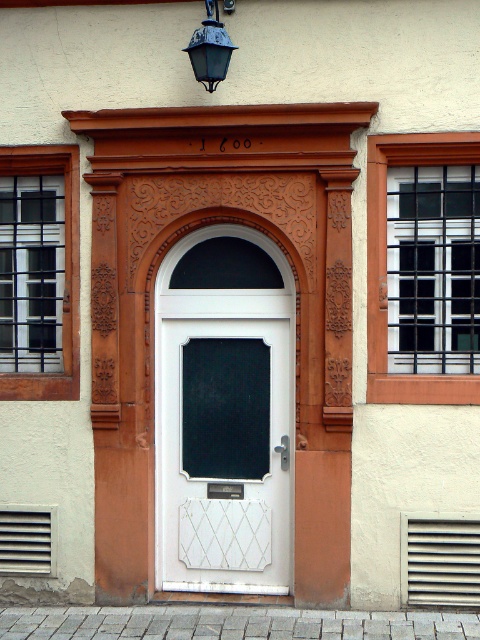
You are standing in front of the building and see the point marked at coordinates (x=223, y=452). Which object is this point located on?

The point marked at coordinates (x=223, y=452) is located on the white glossy door at center.

You are an architect designing a new building inspired by this facade. You need to ensure that the matte black glass at left and the black metal bars at right are proportionate. Based on the original design, which object should be adjusted to match the other in terms of height?

The matte black glass at left is shorter than the black metal bars at right, so the matte black glass at left should be made taller to match the height of the black metal bars at right.